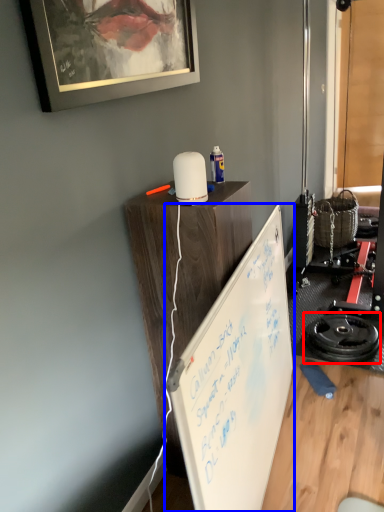
Question: Which object appears farthest to the camera in this image, wheel (highlighted by a red box) or whiteboard (highlighted by a blue box)?

Choices:
 (A) wheel
 (B) whiteboard

Answer: (A)